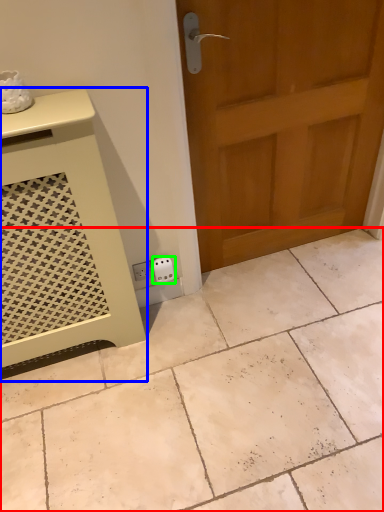
Question: Which is farther away from ceramic tile (highlighted by a red box)? vanity (highlighted by a blue box) or electric outlet (highlighted by a green box)?

Choices:
 (A) vanity
 (B) electric outlet

Answer: (B)